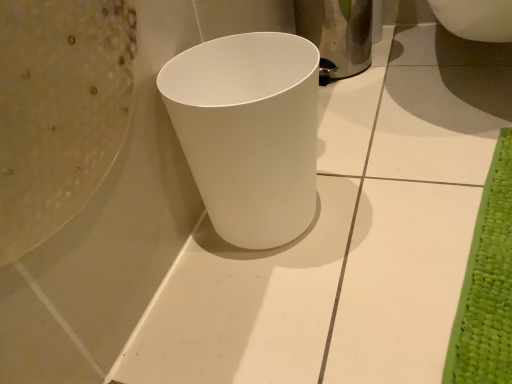
I want to click on vacant space to the right of white matte trash can at center, so click(388, 197).